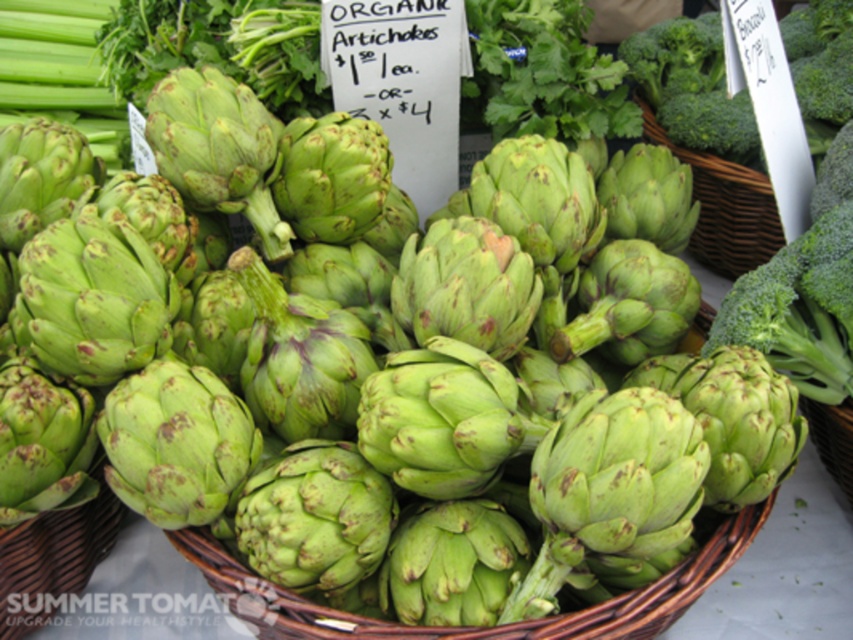
How distant is green wicker basket at center from woven brown basket at right?

28.79 inches

Who is positioned more to the right, green wicker basket at center or woven brown basket at right?

From the viewer's perspective, woven brown basket at right appears more on the right side.

What do you see at coordinates (486, 627) in the screenshot? I see `green wicker basket at center` at bounding box center [486, 627].

Where is `green wicker basket at center`? This screenshot has width=853, height=640. green wicker basket at center is located at coordinates (486, 627).